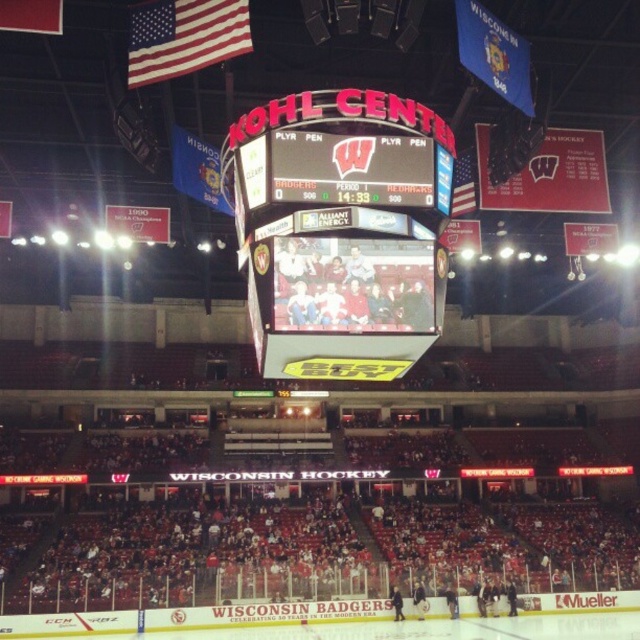
Is matte digital display at center thinner than american flag at upper left?

No.

Does matte digital display at center appear under american flag at upper left?

Yes, matte digital display at center is below american flag at upper left.

Image resolution: width=640 pixels, height=640 pixels. What do you see at coordinates (340, 230) in the screenshot?
I see `matte digital display at center` at bounding box center [340, 230].

In order to click on matte digital display at center in this screenshot , I will do `click(340, 230)`.